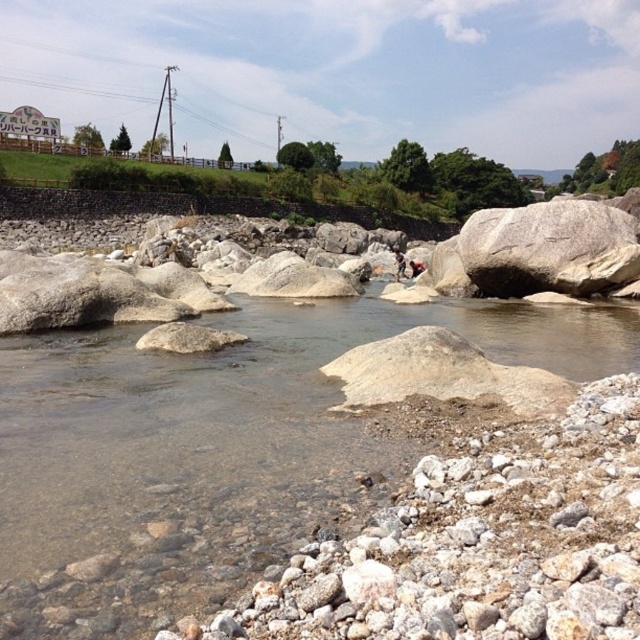
You are standing on the grassy embankment and see the clear water at center and the dark brown leather jacket at center in the river. Which object is closer to your current position?

The dark brown leather jacket at center is closer to your current position because it is above the clear water at center, which is located below it.